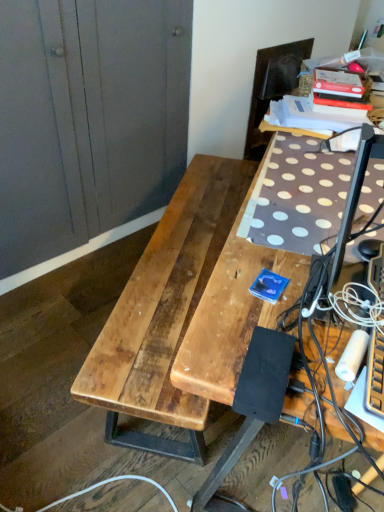
Question: Does natural wood table at center come in front of dark brown leather swivel chair at upper right?

Choices:
 (A) no
 (B) yes

Answer: (B)

Question: From the image's perspective, does natural wood table at center appear lower than dark brown leather swivel chair at upper right?

Choices:
 (A) no
 (B) yes

Answer: (B)

Question: Considering the relative positions of natural wood table at center and dark brown leather swivel chair at upper right in the image provided, is natural wood table at center to the right of dark brown leather swivel chair at upper right from the viewer's perspective?

Choices:
 (A) yes
 (B) no

Answer: (B)

Question: Can you confirm if natural wood table at center is thinner than dark brown leather swivel chair at upper right?

Choices:
 (A) no
 (B) yes

Answer: (A)

Question: Considering the relative sizes of natural wood table at center and dark brown leather swivel chair at upper right in the image provided, is natural wood table at center smaller than dark brown leather swivel chair at upper right?

Choices:
 (A) no
 (B) yes

Answer: (A)

Question: Can you confirm if natural wood table at center is bigger than dark brown leather swivel chair at upper right?

Choices:
 (A) yes
 (B) no

Answer: (A)

Question: Is brown wooden desk at center bigger than wooden dresser at left?

Choices:
 (A) yes
 (B) no

Answer: (A)

Question: Does brown wooden desk at center have a greater width compared to wooden dresser at left?

Choices:
 (A) no
 (B) yes

Answer: (B)

Question: Is brown wooden desk at center oriented towards wooden dresser at left?

Choices:
 (A) yes
 (B) no

Answer: (B)

Question: Is brown wooden desk at center at the left side of wooden dresser at left?

Choices:
 (A) no
 (B) yes

Answer: (A)

Question: Is brown wooden desk at center positioned before wooden dresser at left?

Choices:
 (A) yes
 (B) no

Answer: (A)

Question: Is brown wooden desk at center looking in the opposite direction of wooden dresser at left?

Choices:
 (A) yes
 (B) no

Answer: (A)

Question: Does black rubber extension cord at lower right appear on the right side of natural wood table at center?

Choices:
 (A) no
 (B) yes

Answer: (B)